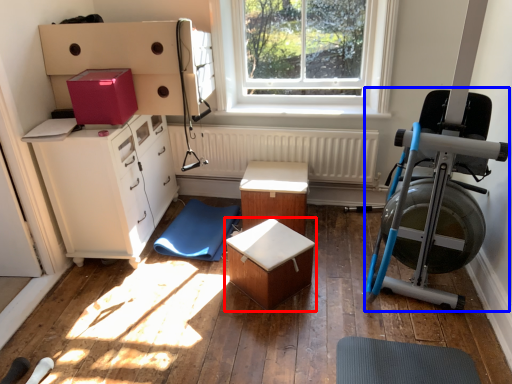
Question: Among these objects, which one is farthest to the camera, table (highlighted by a red box) or baby carriage (highlighted by a blue box)?

Choices:
 (A) table
 (B) baby carriage

Answer: (A)